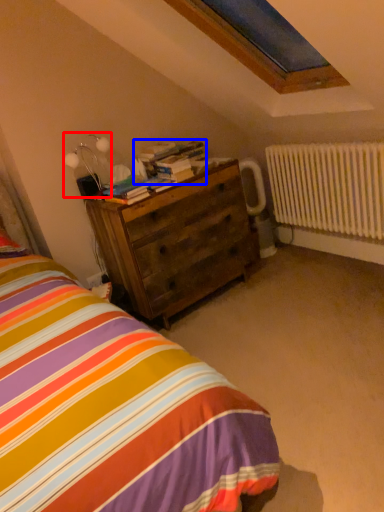
Question: Among these objects, which one is farthest to the camera, table lamp (highlighted by a red box) or book (highlighted by a blue box)?

Choices:
 (A) table lamp
 (B) book

Answer: (B)